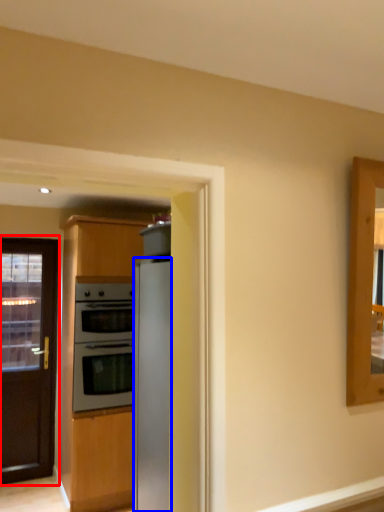
Question: Which point is further to the camera, door (highlighted by a red box) or refrigerator (highlighted by a blue box)?

Choices:
 (A) door
 (B) refrigerator

Answer: (A)